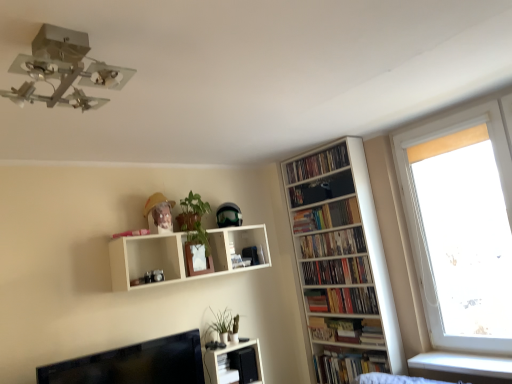
Question: From a real-world perspective, is white glossy shelf at lower center, which appears as the first shelf when ordered from the bottom, on white wooden bookcase at right?

Choices:
 (A) no
 (B) yes

Answer: (A)

Question: Does white glossy shelf at lower center, the second shelf positioned from the top, appear on the left side of white wooden bookcase at right?

Choices:
 (A) yes
 (B) no

Answer: (A)

Question: Can you confirm if white glossy shelf at lower center, which appears as the first shelf when ordered from the bottom, is bigger than white wooden bookcase at right?

Choices:
 (A) no
 (B) yes

Answer: (A)

Question: Does white glossy shelf at lower center, which appears as the first shelf when ordered from the bottom, touch white wooden bookcase at right?

Choices:
 (A) yes
 (B) no

Answer: (B)

Question: Is white glossy shelf at lower center, the second shelf positioned from the top, oriented away from white wooden bookcase at right?

Choices:
 (A) no
 (B) yes

Answer: (A)

Question: From the image's perspective, is white glossy shelf at lower center, which appears as the first shelf when ordered from the bottom, above white wooden bookcase at right?

Choices:
 (A) no
 (B) yes

Answer: (A)

Question: Does white glossy shelf at lower center, which appears as the first shelf when ordered from the bottom, lie behind black glossy monitor at lower left?

Choices:
 (A) no
 (B) yes

Answer: (B)

Question: Are white glossy shelf at lower center, which appears as the first shelf when ordered from the bottom, and black glossy monitor at lower left located far from each other?

Choices:
 (A) yes
 (B) no

Answer: (B)

Question: Does white glossy shelf at lower center, which appears as the first shelf when ordered from the bottom, have a lesser height compared to black glossy monitor at lower left?

Choices:
 (A) no
 (B) yes

Answer: (A)

Question: From the image's perspective, is white glossy shelf at lower center, which appears as the first shelf when ordered from the bottom, below black glossy monitor at lower left?

Choices:
 (A) no
 (B) yes

Answer: (B)

Question: Could you tell me if white glossy shelf at lower center, which appears as the first shelf when ordered from the bottom, is turned towards black glossy monitor at lower left?

Choices:
 (A) no
 (B) yes

Answer: (A)

Question: Considering the relative sizes of white glossy shelf at lower center, which appears as the first shelf when ordered from the bottom, and black glossy monitor at lower left in the image provided, is white glossy shelf at lower center, which appears as the first shelf when ordered from the bottom, thinner than black glossy monitor at lower left?

Choices:
 (A) no
 (B) yes

Answer: (A)

Question: From the image's perspective, does wooden shelf at upper right, which is counted as the first book, starting from the top, appear lower than green matte plant at upper center, placed as the 2th plant when sorted from bottom to top?

Choices:
 (A) yes
 (B) no

Answer: (B)